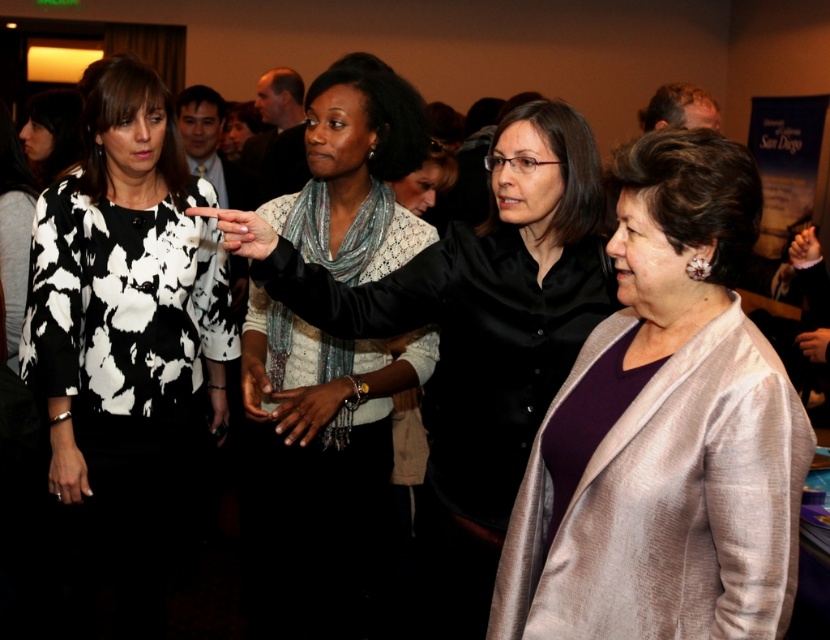
Is silky beige coat at center shorter than black and white printed blouse at left?

Yes, silky beige coat at center is shorter than black and white printed blouse at left.

In the scene shown: Is silky beige coat at center below black and white printed blouse at left?

Yes.

Where is `silky beige coat at center`? The width and height of the screenshot is (830, 640). silky beige coat at center is located at coordinates (664, 432).

Which is more to the right, silky beige coat at center or white lace blouse at center?

Positioned to the right is silky beige coat at center.

Who is taller, silky beige coat at center or white lace blouse at center?

With more height is white lace blouse at center.

Identify the location of silky beige coat at center. The image size is (830, 640). (664, 432).

Which is in front, point (143, 413) or point (365, 365)?

Point (143, 413) is in front.

Can you confirm if black and white printed blouse at left is positioned to the left of white lace blouse at center?

Yes, black and white printed blouse at left is to the left of white lace blouse at center.

Who is more distant from viewer, (116, 301) or (255, 289)?

The point (255, 289) is behind.

Image resolution: width=830 pixels, height=640 pixels. I want to click on black and white printed blouse at left, so click(127, 326).